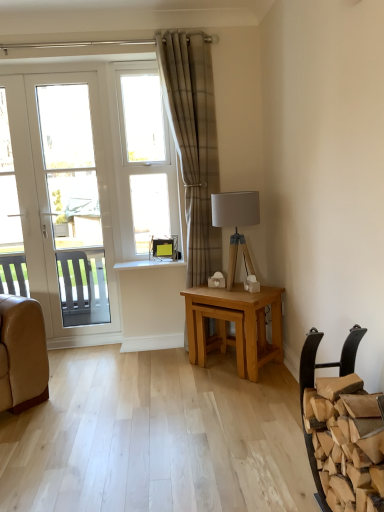
Question: Is plaid fabric curtain at center positioned in front of light oak wooden table at center?

Choices:
 (A) yes
 (B) no

Answer: (B)

Question: Is plaid fabric curtain at center touching light oak wooden table at center?

Choices:
 (A) yes
 (B) no

Answer: (B)

Question: Is plaid fabric curtain at center facing towards light oak wooden table at center?

Choices:
 (A) no
 (B) yes

Answer: (B)

Question: Can you confirm if plaid fabric curtain at center is wider than light oak wooden table at center?

Choices:
 (A) yes
 (B) no

Answer: (B)

Question: From a real-world perspective, is plaid fabric curtain at center positioned over light oak wooden table at center based on gravity?

Choices:
 (A) no
 (B) yes

Answer: (B)

Question: Can you confirm if plaid fabric curtain at center is smaller than light oak wooden table at center?

Choices:
 (A) yes
 (B) no

Answer: (B)

Question: Does matte gray fabric lampshade at right have a lesser width compared to brown leather chair at lower right?

Choices:
 (A) no
 (B) yes

Answer: (B)

Question: Is matte gray fabric lampshade at right far away from brown leather chair at lower right?

Choices:
 (A) no
 (B) yes

Answer: (B)

Question: Can you confirm if matte gray fabric lampshade at right is shorter than brown leather chair at lower right?

Choices:
 (A) yes
 (B) no

Answer: (A)

Question: Considering the relative sizes of matte gray fabric lampshade at right and brown leather chair at lower right in the image provided, is matte gray fabric lampshade at right wider than brown leather chair at lower right?

Choices:
 (A) no
 (B) yes

Answer: (A)

Question: Is matte gray fabric lampshade at right oriented away from brown leather chair at lower right?

Choices:
 (A) no
 (B) yes

Answer: (A)

Question: Is the depth of matte gray fabric lampshade at right greater than that of brown leather chair at lower right?

Choices:
 (A) no
 (B) yes

Answer: (B)

Question: Would you say brown leather chair at lower right contains white glossy door at left?

Choices:
 (A) yes
 (B) no

Answer: (B)